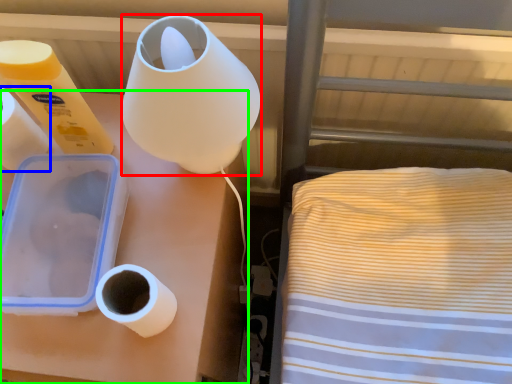
Question: Based on their relative distances, which object is nearer to lamp (highlighted by a red box)? Choose from paper towel (highlighted by a blue box) and furniture (highlighted by a green box).

Choices:
 (A) paper towel
 (B) furniture

Answer: (B)